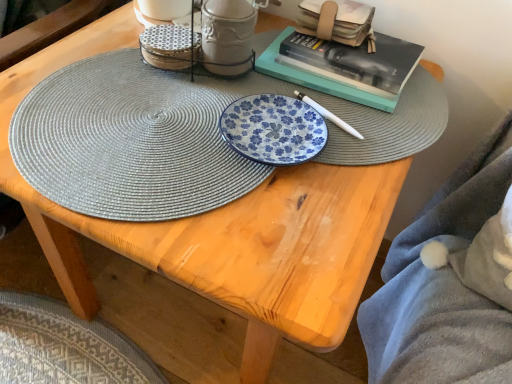
At what (x,y) coordinates should I click in order to perform the action: click on vacant area situated to the left side of matte ceramic mug at upper center, which ranks as the first tableware in right-to-left order. Please return your answer as a coordinate pair (x, y). This screenshot has width=512, height=384. Looking at the image, I should click on (102, 67).